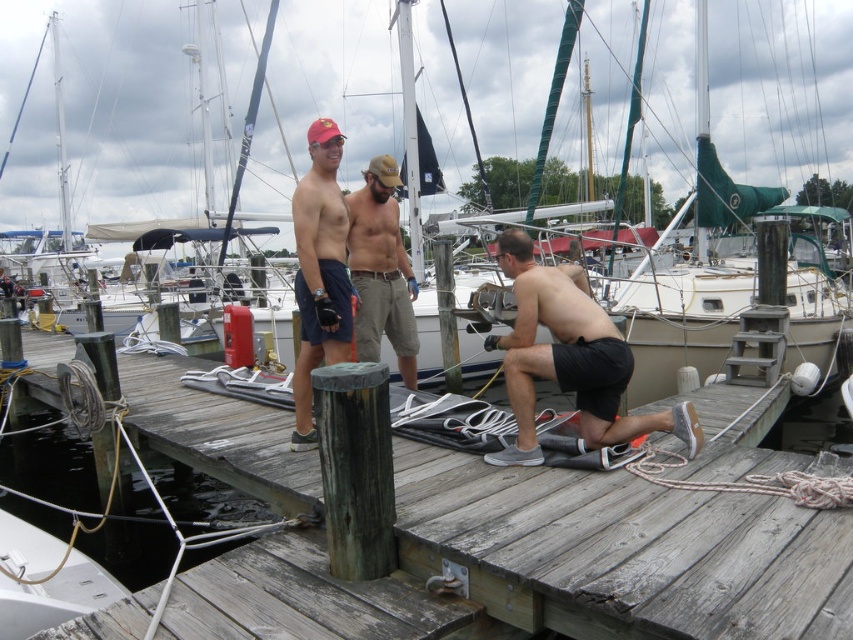
You are standing on the dock and want to move from the white matte sailboat at center to the tan cotton shorts at center. In which direction should you move?

You should move to the right to reach the tan cotton shorts at center from the white matte sailboat at center because the sailboat is to the left of the shorts.

What object is located at the coordinates point (622,552)?

The point (622,552) marks the weathered wood dock at center.